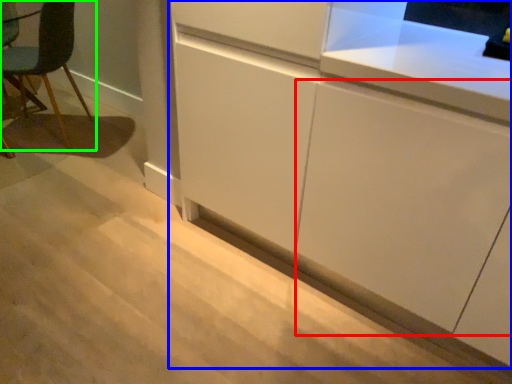
Question: Considering the real-world distances, which object is farthest from cabinetry (highlighted by a red box)? cabinetry (highlighted by a blue box) or chair (highlighted by a green box)?

Choices:
 (A) cabinetry
 (B) chair

Answer: (B)